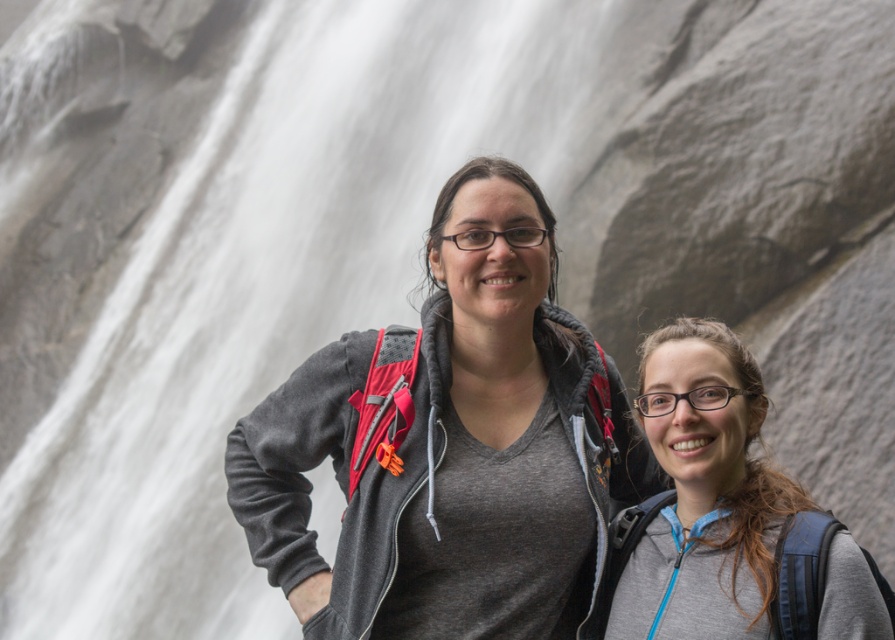
Is point (621, 483) farther from camera compared to point (627, 561)?

Yes, point (621, 483) is farther from viewer.

Which is behind, point (425, 572) or point (697, 497)?

Positioned behind is point (425, 572).

At what (x,y) coordinates should I click in order to perform the action: click on gray matte jacket at center. Please return your answer as a coordinate pair (x, y). The image size is (895, 640). Looking at the image, I should click on (450, 445).